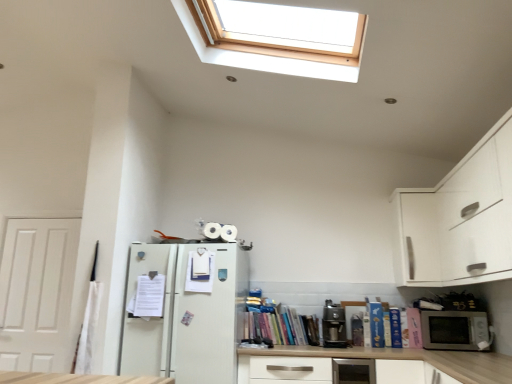
Question: From the image's perspective, is blue hardcover book at lower right, the 6th book from the left, beneath white matte drawer at center?

Choices:
 (A) no
 (B) yes

Answer: (A)

Question: Does blue hardcover book at lower right, the 6th book from the left, have a smaller size compared to white matte drawer at center?

Choices:
 (A) yes
 (B) no

Answer: (A)

Question: From a real-world perspective, does blue hardcover book at lower right, the 6th book from the left, stand above white matte drawer at center?

Choices:
 (A) yes
 (B) no

Answer: (A)

Question: Is the position of blue hardcover book at lower right, which appears as the second book when viewed from the right, more distant than that of white matte drawer at center?

Choices:
 (A) no
 (B) yes

Answer: (B)

Question: Is blue hardcover book at lower right, which appears as the second book when viewed from the right, located outside white matte drawer at center?

Choices:
 (A) no
 (B) yes

Answer: (B)

Question: Is blue hardcover book at lower right, the 6th book from the left, oriented towards white matte drawer at center?

Choices:
 (A) yes
 (B) no

Answer: (B)

Question: Does blue hardcover book at lower right, which appears as the second book when viewed from the right, have a lesser width compared to hardcover books at center, which ranks as the 3th book in left-to-right order?

Choices:
 (A) no
 (B) yes

Answer: (B)

Question: Is blue hardcover book at lower right, which appears as the second book when viewed from the right, to the right of hardcover books at center, which ranks as the 3th book in left-to-right order, from the viewer's perspective?

Choices:
 (A) no
 (B) yes

Answer: (B)

Question: Is blue hardcover book at lower right, which appears as the second book when viewed from the right, taller than hardcover books at center, placed as the 5th book when sorted from right to left?

Choices:
 (A) yes
 (B) no

Answer: (A)

Question: Considering the relative sizes of blue hardcover book at lower right, which appears as the second book when viewed from the right, and hardcover books at center, which ranks as the 3th book in left-to-right order, in the image provided, is blue hardcover book at lower right, which appears as the second book when viewed from the right, bigger than hardcover books at center, which ranks as the 3th book in left-to-right order,?

Choices:
 (A) yes
 (B) no

Answer: (B)

Question: From a real-world perspective, is blue hardcover book at lower right, the 6th book from the left, under hardcover books at center, placed as the 5th book when sorted from right to left?

Choices:
 (A) yes
 (B) no

Answer: (B)

Question: Is hardcover books at center, placed as the 5th book when sorted from right to left, at the back of blue hardcover book at lower right, which appears as the second book when viewed from the right?

Choices:
 (A) no
 (B) yes

Answer: (A)

Question: From the image's perspective, is satin silver toaster at lower center over white paper at left, the 1th book positioned from the left?

Choices:
 (A) no
 (B) yes

Answer: (A)